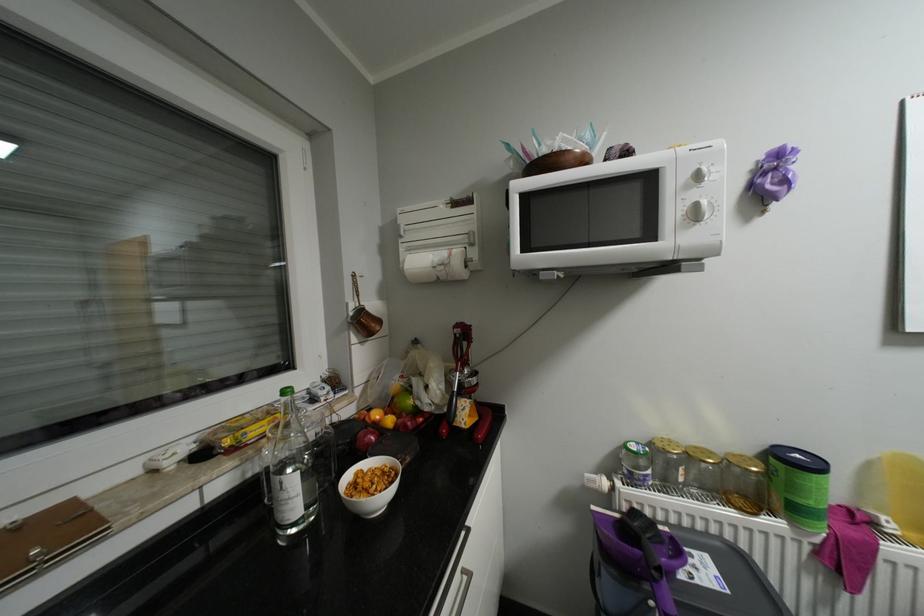
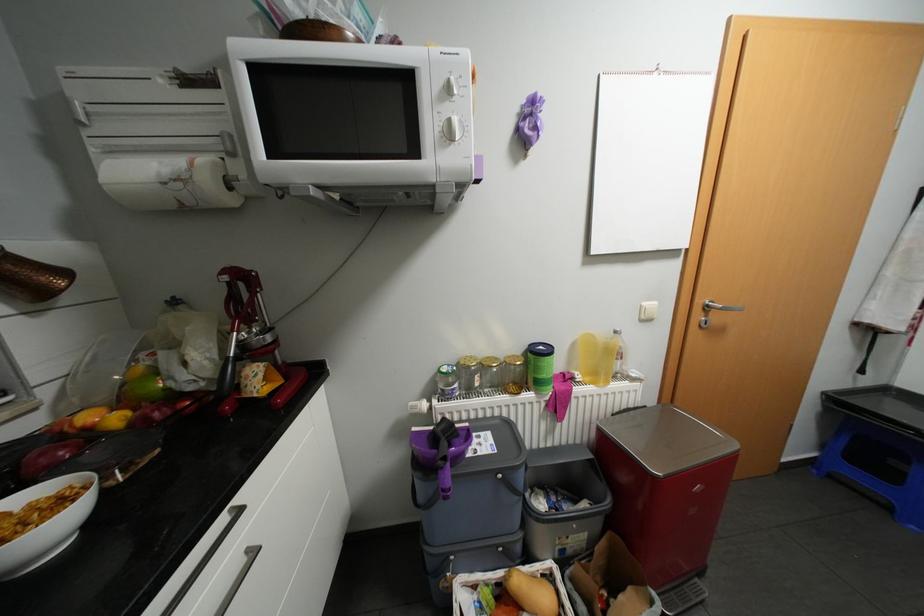
In the second image, find the point that corresponds to (470,570) in the first image.

(256, 549)